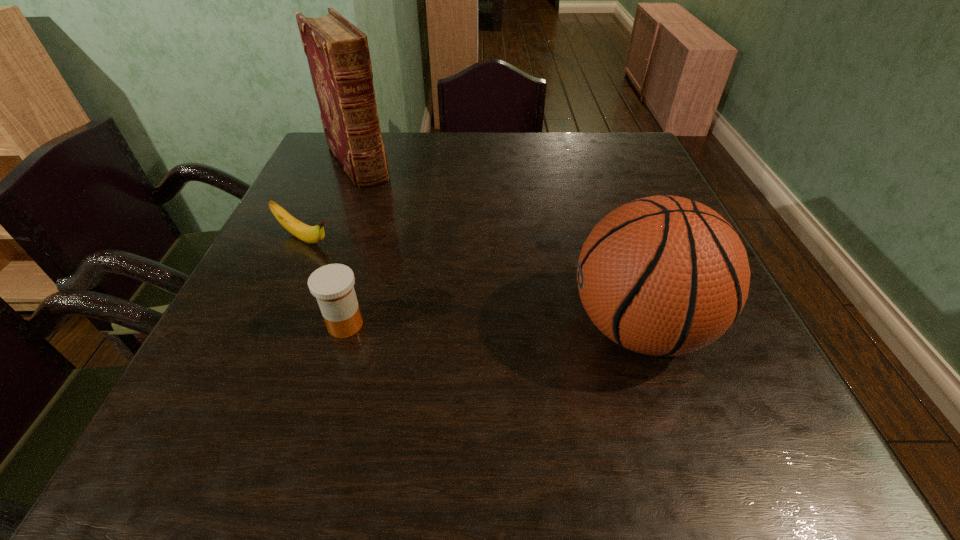
What are the coordinates of `unoccupied position between the hardback book and the basketball` in the screenshot? It's located at (498, 245).

I want to click on vacant point located between the basketball and the medicine, so click(492, 326).

You are a GUI agent. You are given a task and a screenshot of the screen. Output one action in this format:
    pyautogui.click(x=<x>, y=<y>)
    Task: Click on the free space between the second tallest object and the second shortest object
    
    Given the screenshot: What is the action you would take?
    pyautogui.click(x=492, y=326)

Find the location of `free space between the farthest object and the rightmost object`. free space between the farthest object and the rightmost object is located at coordinates (498, 245).

Where is `free space between the farthest object and the shortest object`? free space between the farthest object and the shortest object is located at coordinates (331, 201).

Locate an element on the screen. This screenshot has height=540, width=960. vacant point located between the basketball and the farthest object is located at coordinates (498, 245).

At what (x,y) coordinates should I click in order to perform the action: click on vacant space that is in between the banana and the basketball. Please return your answer as a coordinate pair (x, y). This screenshot has width=960, height=540. Looking at the image, I should click on (471, 283).

Find the location of `free area in between the third nearest object and the second tallest object`. free area in between the third nearest object and the second tallest object is located at coordinates (471, 283).

Image resolution: width=960 pixels, height=540 pixels. I want to click on vacant area that lies between the banana and the hardback book, so click(331, 201).

Identify which object is the closest to the third tallest object. Please provide its 2D coordinates. Your answer should be formatted as a tuple, i.e. [(x, y)], where the tuple contains the x and y coordinates of a point satisfying the conditions above.

[(310, 234)]